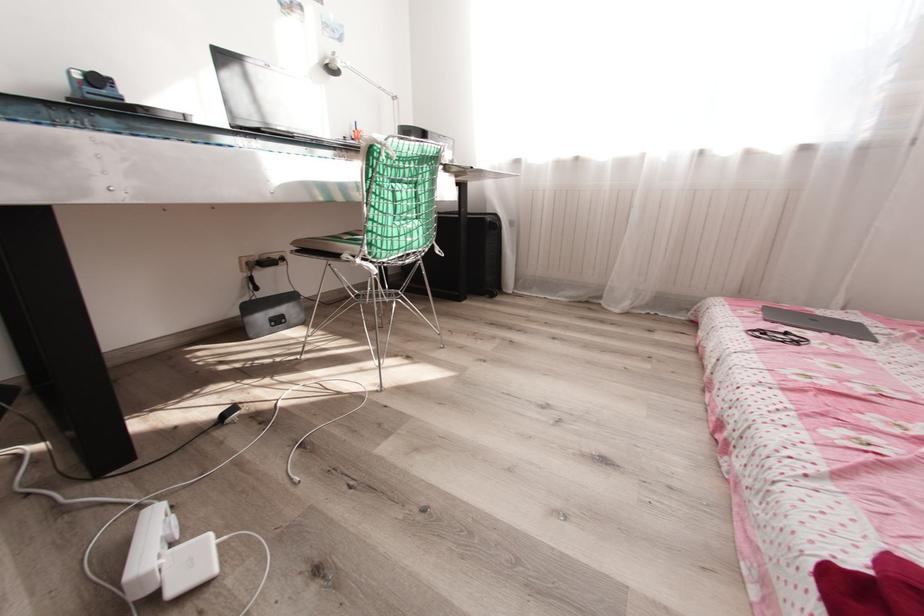
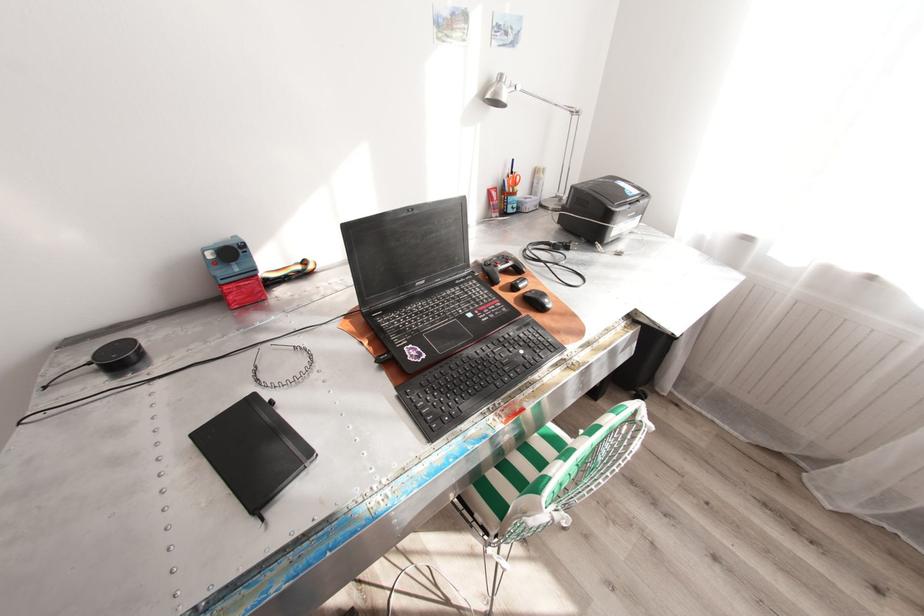
Find the pixel in the second image that matches pixel 81 75 in the first image.

(215, 254)